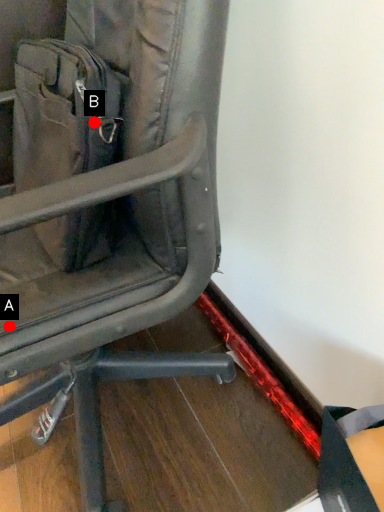
Question: Two points are circled on the image, labeled by A and B beside each circle. Which point appears farthest from the camera in this image?

Choices:
 (A) A is further
 (B) B is further

Answer: (A)